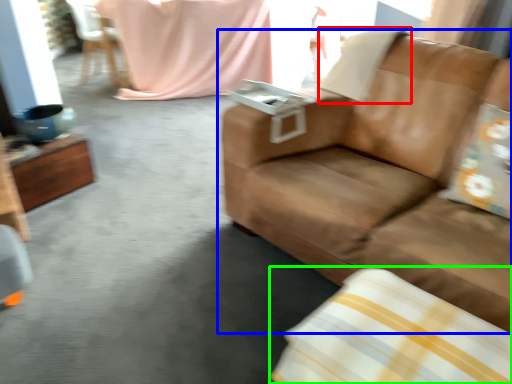
Question: Considering the real-world distances, which object is farthest from pillow (highlighted by a red box)? studio couch (highlighted by a blue box) or pillow (highlighted by a green box)?

Choices:
 (A) studio couch
 (B) pillow

Answer: (B)